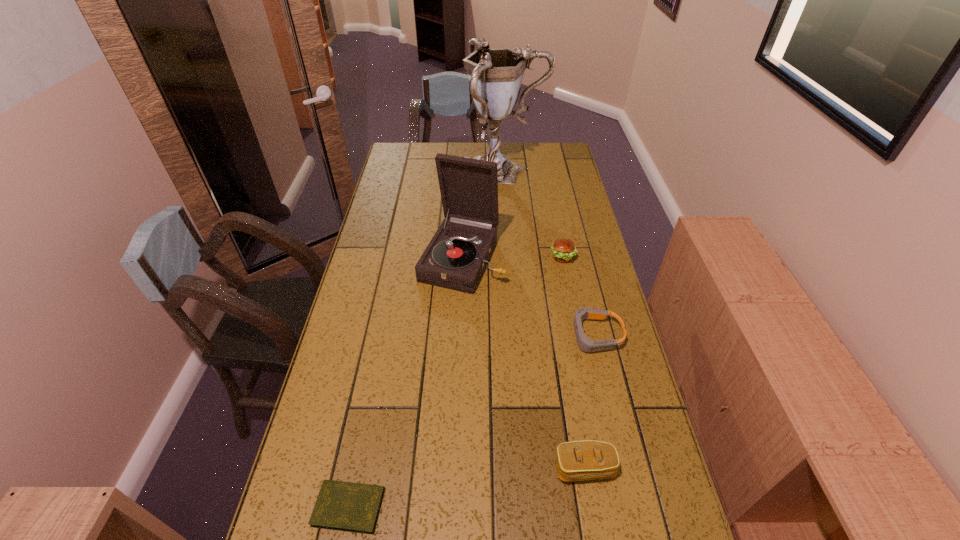
This screenshot has width=960, height=540. I want to click on free point between the second tallest object and the second shortest object, so click(x=528, y=298).

Identify the location of vacant space that's between the clutch bag and the trophy cup. This screenshot has height=540, width=960. (543, 319).

Where is `free space between the fourth farthest object and the phonograph record`? free space between the fourth farthest object and the phonograph record is located at coordinates (528, 298).

Identify the location of free space between the clutch bag and the hamburger. This screenshot has width=960, height=540. (574, 363).

At what (x,y) coordinates should I click in order to perform the action: click on free space between the diary and the fifth tallest object. Please return your answer as a coordinate pair (x, y). Looking at the image, I should click on (471, 421).

The height and width of the screenshot is (540, 960). What are the coordinates of `object that is the second closest one to the shortest object` in the screenshot? It's located at (585, 344).

Identify the location of object that stands as the third closest to the clutch bag. Image resolution: width=960 pixels, height=540 pixels. (456, 257).

In order to click on vacant area that satisfies the following two spatial constraints: 1. on the back side of the fifth shortest object; 2. on the left side of the farthest object in this screenshot , I will do `click(466, 171)`.

Where is `vacant space that satisfies the following two spatial constraints: 1. on the front and back of the goggles; 2. on the zipper side of the clutch bag`? The height and width of the screenshot is (540, 960). vacant space that satisfies the following two spatial constraints: 1. on the front and back of the goggles; 2. on the zipper side of the clutch bag is located at coordinates (626, 468).

Where is `vacant region that satisfies the following two spatial constraints: 1. on the back side of the shortest object; 2. on the left side of the tallest object`? This screenshot has height=540, width=960. vacant region that satisfies the following two spatial constraints: 1. on the back side of the shortest object; 2. on the left side of the tallest object is located at coordinates (416, 171).